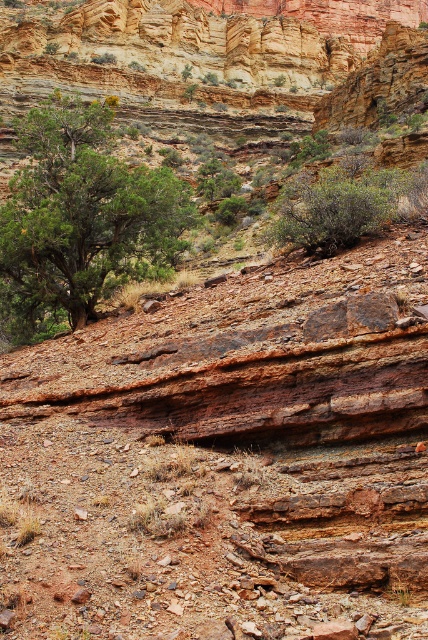
Question: Which object is closer to the camera taking this photo?

Choices:
 (A) green leafy bush at center
 (B) green leafy tree at left

Answer: (A)

Question: From the image, what is the correct spatial relationship of green leafy tree at left in relation to green leafy bush at center?

Choices:
 (A) above
 (B) below

Answer: (A)

Question: Which object is farther from the camera taking this photo?

Choices:
 (A) green leafy bush at center
 (B) green leafy tree at left

Answer: (B)

Question: Is green leafy tree at left below green leafy bush at center?

Choices:
 (A) yes
 (B) no

Answer: (B)

Question: In this image, where is green leafy tree at left located relative to green leafy bush at center?

Choices:
 (A) left
 (B) right

Answer: (A)